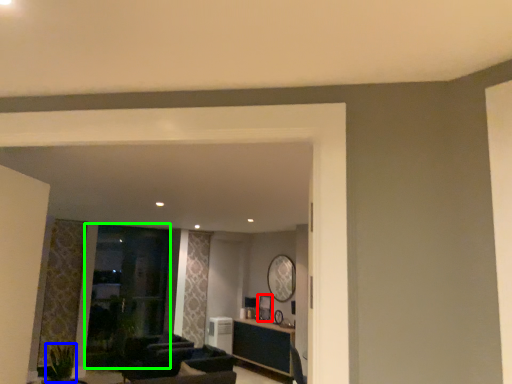
Question: Which object is the closest to the picture frame (highlighted by a red box)? Choose among these: plant (highlighted by a blue box) or glass door (highlighted by a green box).

Choices:
 (A) plant
 (B) glass door

Answer: (B)